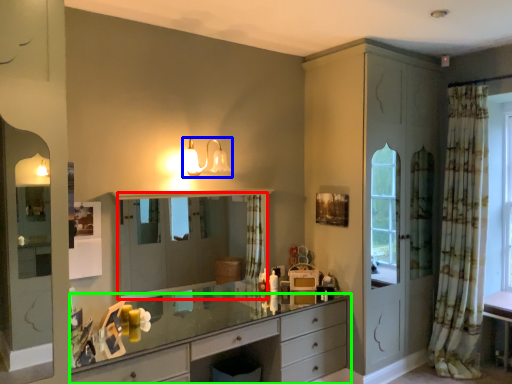
Question: Based on their relative distances, which object is farther from mirror (highlighted by a red box)? Choose from light fixture (highlighted by a blue box) and chest of drawers (highlighted by a green box).

Choices:
 (A) light fixture
 (B) chest of drawers

Answer: (B)